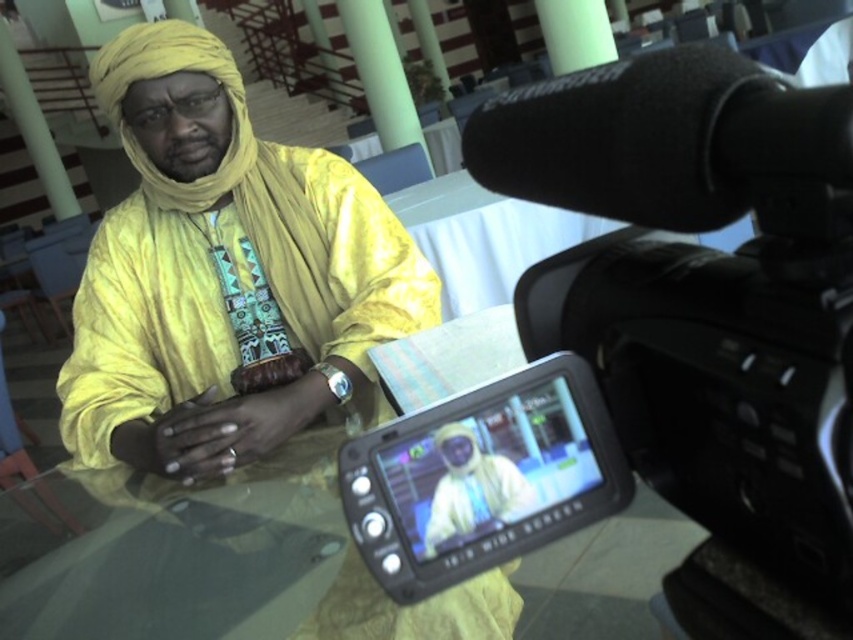
Question: Which point appears closest to the camera in this image?

Choices:
 (A) (142, 609)
 (B) (468, 460)
 (C) (671, 275)
 (D) (112, 442)

Answer: (C)

Question: Which point appears farthest from the camera in this image?

Choices:
 (A) (524, 486)
 (B) (390, 508)
 (C) (431, 317)
 (D) (76, 474)

Answer: (C)

Question: Is black plastic video camera at upper right in front of matte yellow fabric at center?

Choices:
 (A) no
 (B) yes

Answer: (B)

Question: Is transparent glass table at center further to the viewer compared to matte yellow turban at upper left?

Choices:
 (A) yes
 (B) no

Answer: (A)

Question: Can you confirm if black plastic video camera at upper right is positioned to the right of transparent glass table at center?

Choices:
 (A) no
 (B) yes

Answer: (B)

Question: Which object is positioned closest to the matte yellow turban at upper left?

Choices:
 (A) black plastic camera at center
 (B) black plastic video camera at upper right
 (C) transparent glass table at center
 (D) matte yellow fabric at center

Answer: (A)